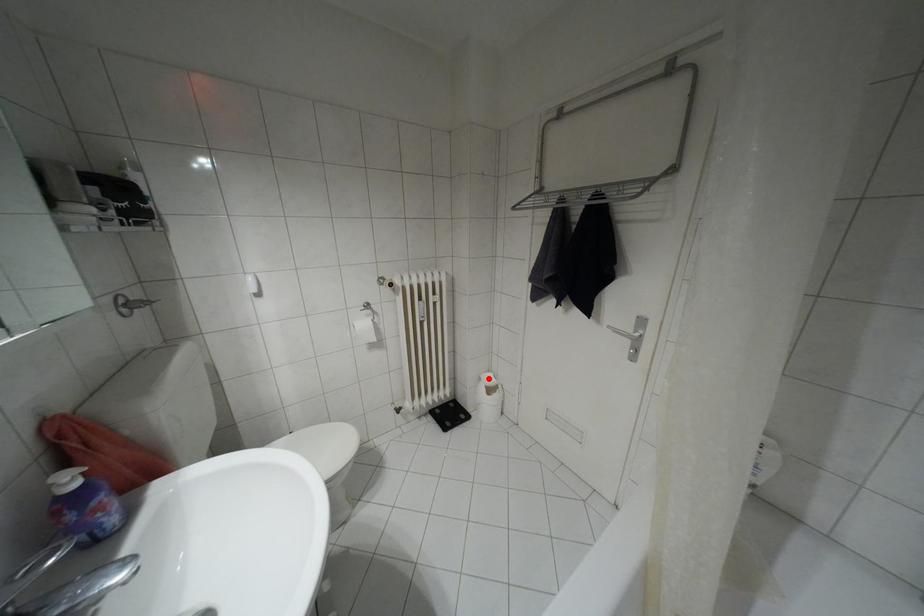
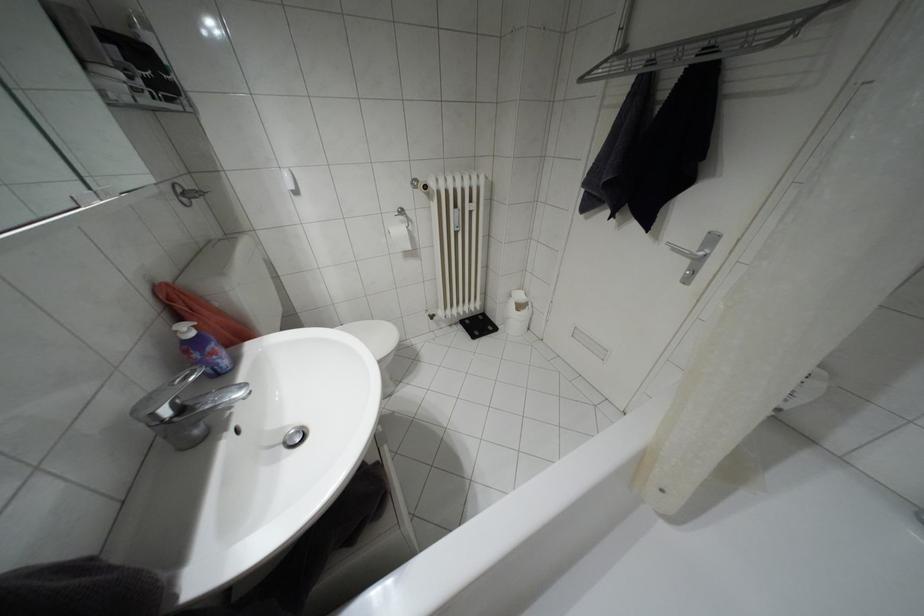
Locate, in the second image, the point that corresponds to the highlighted location in the first image.

(518, 296)